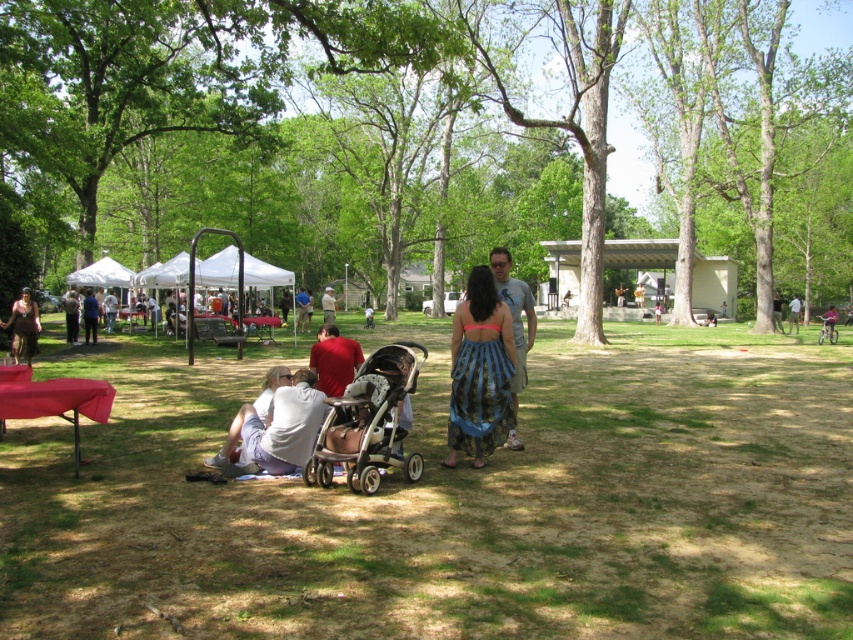
Is blue printed dress at center bigger than gray cotton t-shirt at center?

Actually, blue printed dress at center might be smaller than gray cotton t-shirt at center.

Is blue printed dress at center in front of gray cotton t-shirt at center?

Yes, blue printed dress at center is closer to the viewer.

At what (x,y) coordinates should I click in order to perform the action: click on blue printed dress at center. Please return your answer as a coordinate pair (x, y). Looking at the image, I should click on (479, 371).

This screenshot has width=853, height=640. Identify the location of blue printed dress at center. (479, 371).

Who is lower down, matte red shirt at center or matte gray shirt at center?

matte red shirt at center is lower down.

Who is shorter, matte red shirt at center or matte gray shirt at center?

matte red shirt at center is shorter.

Which is in front, point (312, 344) or point (302, 300)?

Point (312, 344) is in front.

Locate an element on the screen. matte red shirt at center is located at coordinates (334, 360).

Between point (613, 609) and point (28, 353), which one is positioned in front?

Point (613, 609) is in front.

This screenshot has width=853, height=640. Identify the location of green grass at lower left. (451, 500).

I want to click on green grass at lower left, so pos(451,500).